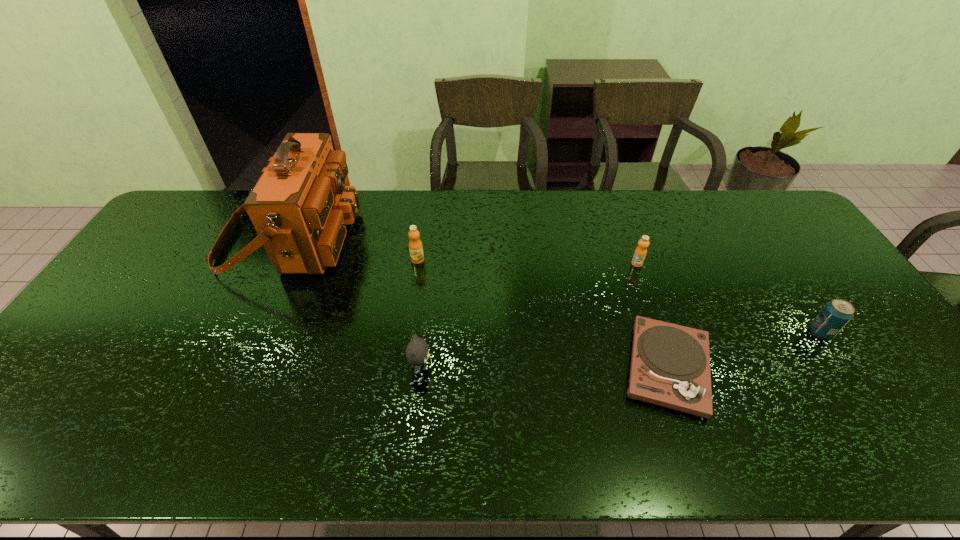
Find the location of a particular element. This screenshot has height=540, width=960. empty location between the kitten and the shorter orange juice is located at coordinates (529, 315).

The image size is (960, 540). In order to click on the second closest object to the pop soda in this screenshot , I will do `click(640, 252)`.

I want to click on the fifth closest object to the right orange juice, so click(299, 207).

Where is `vacant area that satisfies the following two spatial constraints: 1. on the face side of the pop soda; 2. on the right side of the satchel`? vacant area that satisfies the following two spatial constraints: 1. on the face side of the pop soda; 2. on the right side of the satchel is located at coordinates (248, 332).

At what (x,y) coordinates should I click in order to perform the action: click on vacant space that satisfies the following two spatial constraints: 1. on the face side of the phonograph_record; 2. on the right side of the tallest object. Please return your answer as a coordinate pair (x, y). Looking at the image, I should click on coord(231,367).

The height and width of the screenshot is (540, 960). I want to click on free space that satisfies the following two spatial constraints: 1. on the front label of the rightmost object; 2. on the right side of the taller orange juice, so click(407, 332).

The image size is (960, 540). I want to click on vacant area that satisfies the following two spatial constraints: 1. on the face side of the tallest object; 2. on the left side of the phonograph_record, so click(x=231, y=367).

What are the coordinates of `free space that satisfies the following two spatial constraints: 1. on the front label of the rightmost object; 2. on the left side of the left orange juice` in the screenshot? It's located at (407, 332).

Identify the location of vacant area that satisfies the following two spatial constraints: 1. on the front label of the right orange juice; 2. on the front-facing side of the kitten. tap(673, 367).

At what (x,y) coordinates should I click in order to perform the action: click on free point that satisfies the following two spatial constraints: 1. on the back side of the phonograph_record; 2. on the front-facing side of the kitten. Please return your answer as a coordinate pair (x, y). This screenshot has width=960, height=540. Looking at the image, I should click on (667, 367).